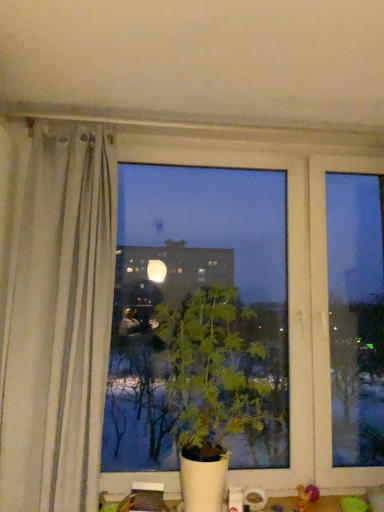
Locate an element on the screen. The image size is (384, 512). green fabric toy at lower right is located at coordinates click(355, 504).

This screenshot has width=384, height=512. Describe the element at coordinates (355, 504) in the screenshot. I see `green fabric toy at lower right` at that location.

What do you see at coordinates (210, 387) in the screenshot?
I see `green leafy plant at center` at bounding box center [210, 387].

The height and width of the screenshot is (512, 384). I want to click on green leafy plant at center, so click(x=210, y=387).

Identify the location of green fabric toy at lower right. (355, 504).

Can you confirm if green leafy plant at center is positioned to the left of green fabric toy at lower right?

Correct, you'll find green leafy plant at center to the left of green fabric toy at lower right.

Which object is further away from the camera taking this photo, green leafy plant at center or green fabric toy at lower right?

green fabric toy at lower right is further away from the camera.

Which point is more distant from viewer, (170, 341) or (367, 503)?

The point (170, 341) is more distant.

From the image's perspective, between green leafy plant at center and green fabric toy at lower right, which one is located above?

green leafy plant at center is shown above in the image.

From a real-world perspective, which object rests below the other?

In real-world perspective, green fabric toy at lower right is lower.

Considering the sizes of green leafy plant at center and green fabric toy at lower right in the image, is green leafy plant at center wider or thinner than green fabric toy at lower right?

In the image, green leafy plant at center appears to be wider than green fabric toy at lower right.

Who is shorter, green leafy plant at center or green fabric toy at lower right?

With less height is green fabric toy at lower right.

Is green leafy plant at center smaller than green fabric toy at lower right?

Actually, green leafy plant at center might be larger than green fabric toy at lower right.

Is green fabric toy at lower right a part of green leafy plant at center?

No, green fabric toy at lower right is located outside of green leafy plant at center.

Are green leafy plant at center and green fabric toy at lower right beside each other?

No.

Is green leafy plant at center looking in the opposite direction of green fabric toy at lower right?

green leafy plant at center is not turned away from green fabric toy at lower right.

Based on the photo, how many degrees apart are the facing directions of green leafy plant at center and green fabric toy at lower right?

1.52 degrees separate the facing orientations of green leafy plant at center and green fabric toy at lower right.

The image size is (384, 512). Find the location of `houseplant above the green fabric toy at lower right (from the image's perspective)`. houseplant above the green fabric toy at lower right (from the image's perspective) is located at coordinates (210, 387).

Which is more to the right, green fabric toy at lower right or green leafy plant at center?

From the viewer's perspective, green fabric toy at lower right appears more on the right side.

Is the depth of green fabric toy at lower right greater than that of green leafy plant at center?

Yes.

Is point (349, 497) farther from viewer compared to point (237, 426)?

Yes, point (349, 497) is farther from viewer.

From the image's perspective, is green fabric toy at lower right on top of green leafy plant at center?

Actually, green fabric toy at lower right appears below green leafy plant at center in the image.

From a real-world perspective, is green fabric toy at lower right positioned over green leafy plant at center based on gravity?

No, from a real-world perspective, green fabric toy at lower right is not above green leafy plant at center.

Is green fabric toy at lower right wider or thinner than green leafy plant at center?

In the image, green fabric toy at lower right appears to be more narrow than green leafy plant at center.

Who is shorter, green fabric toy at lower right or green leafy plant at center?

green fabric toy at lower right is shorter.

Is green fabric toy at lower right smaller than green leafy plant at center?

Correct, green fabric toy at lower right occupies less space than green leafy plant at center.

Consider the image. Is green fabric toy at lower right inside the boundaries of green leafy plant at center, or outside?

green fabric toy at lower right lies outside green leafy plant at center.

Is green fabric toy at lower right directly adjacent to green leafy plant at center?

No, green fabric toy at lower right is not next to green leafy plant at center.

Could you tell me if green fabric toy at lower right is turned towards green leafy plant at center?

No, green fabric toy at lower right is not oriented towards green leafy plant at center.

The height and width of the screenshot is (512, 384). Find the location of `houseplant located above the green fabric toy at lower right (from the image's perspective)`. houseplant located above the green fabric toy at lower right (from the image's perspective) is located at coordinates (210, 387).

This screenshot has width=384, height=512. What are the coordinates of `toy behind the green leafy plant at center` in the screenshot? It's located at (355, 504).

Find the location of `houseplant above the green fabric toy at lower right (from the image's perspective)`. houseplant above the green fabric toy at lower right (from the image's perspective) is located at coordinates (210, 387).